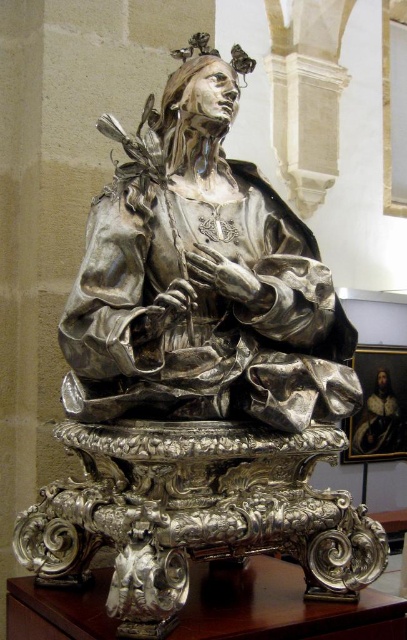
Based on the photo, can you confirm if shiny silver statue at center is positioned below silver statue at center?

Actually, shiny silver statue at center is above silver statue at center.

This screenshot has width=407, height=640. What do you see at coordinates (201, 278) in the screenshot? I see `shiny silver statue at center` at bounding box center [201, 278].

Locate an element on the screen. shiny silver statue at center is located at coordinates (201, 278).